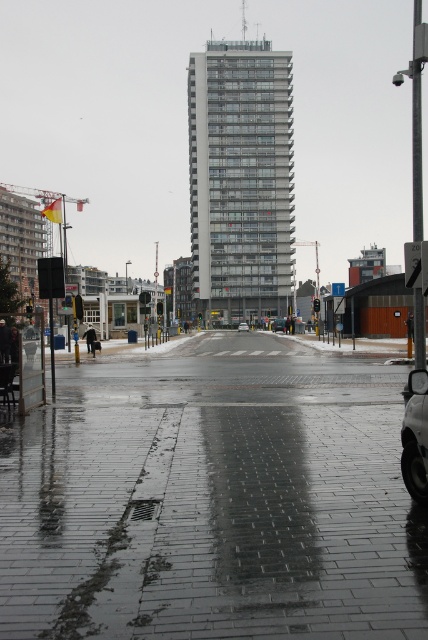
Please look at the image. There is a point at coordinate (213, 500). What object is located at this coordinate?

The point at coordinate (213, 500) is located at the wet brick pavement at center.

You are a delivery person with a cart that is 1.2 meters wide. You need to cross the road but must avoid the wet brick pavement at center. Can you safely navigate around it without getting too close?

The wet brick pavement at center is 3.83 meters away from the viewer. Since the cart is only 1.2 meters wide, you can safely navigate around it by keeping sufficient distance, as the separation is more than enough to avoid proximity.